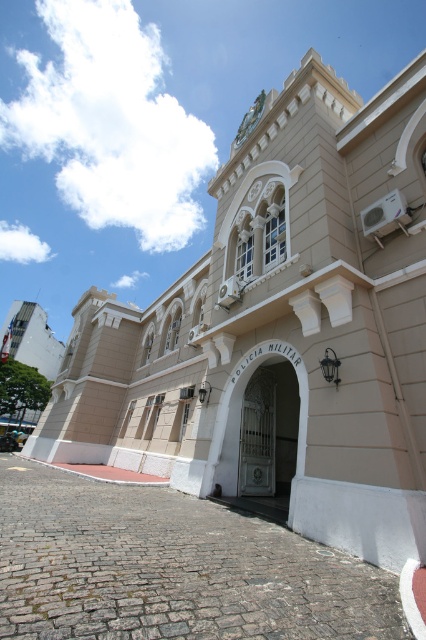
Question: Which of the following is the closest to the observer?

Choices:
 (A) gold metallic clock at upper center
 (B) white metal gate at center

Answer: (B)

Question: Which point appears closest to the camera in this image?

Choices:
 (A) (259, 97)
 (B) (299, 371)

Answer: (B)

Question: Is white metal gate at center above gold metallic clock at upper center?

Choices:
 (A) yes
 (B) no

Answer: (B)

Question: Is white metal gate at center smaller than gold metallic clock at upper center?

Choices:
 (A) no
 (B) yes

Answer: (B)

Question: Is white metal gate at center wider than gold metallic clock at upper center?

Choices:
 (A) no
 (B) yes

Answer: (A)